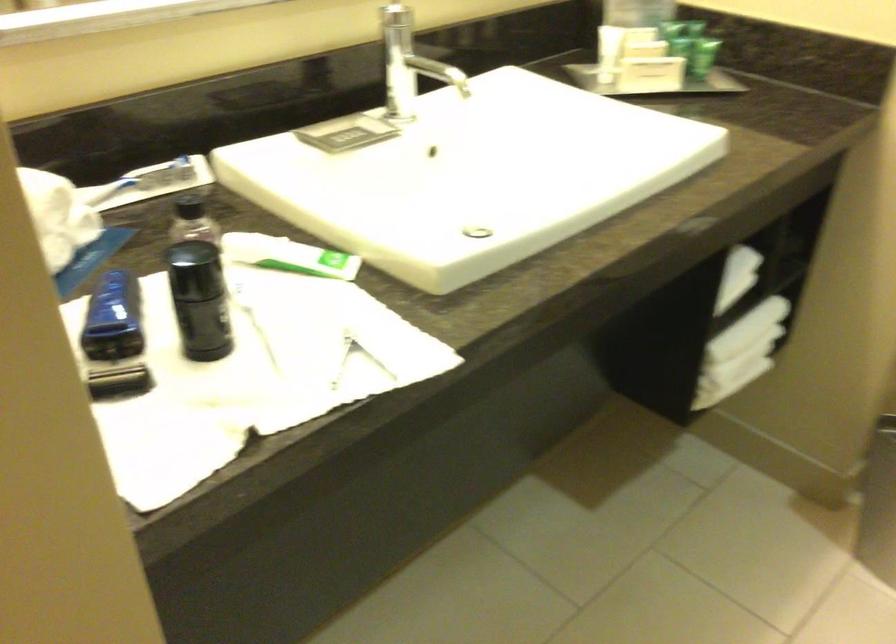
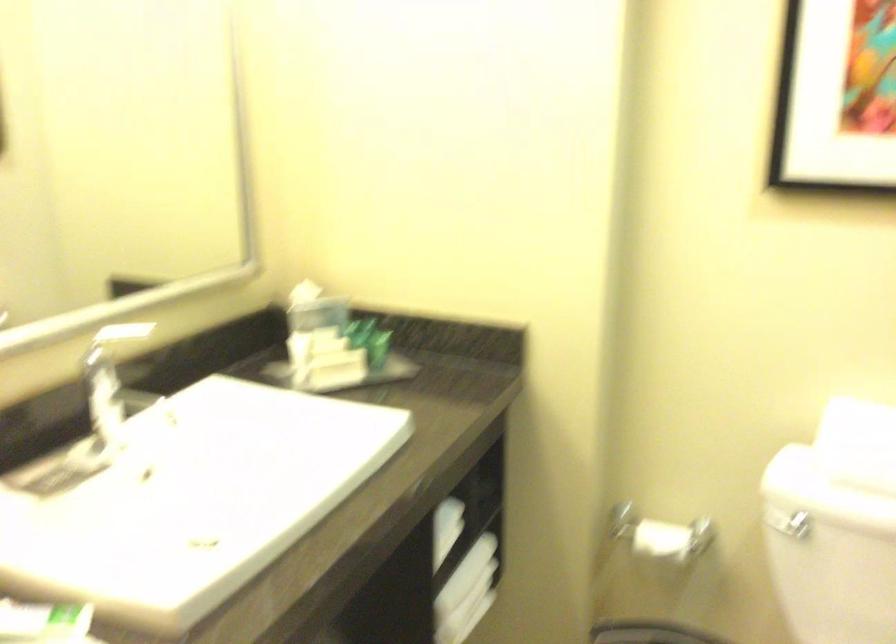
In the second image, find the point that corresponds to (x=750, y=327) in the first image.

(464, 574)